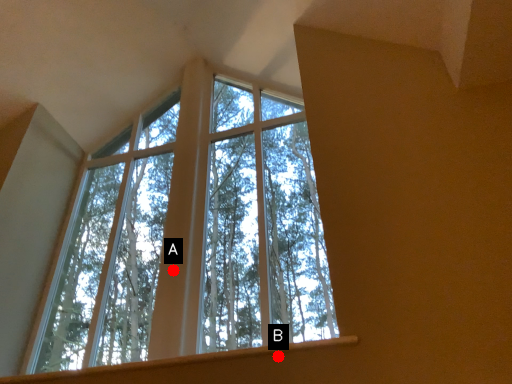
Question: Two points are circled on the image, labeled by A and B beside each circle. Which of the following is the farthest from the observer?

Choices:
 (A) A is further
 (B) B is further

Answer: (A)